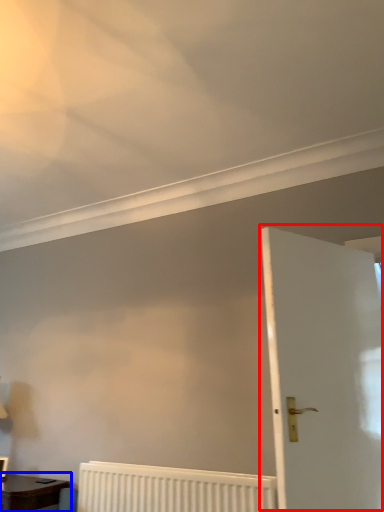
Question: Which object is closer to the camera taking this photo, door (highlighted by a red box) or table (highlighted by a blue box)?

Choices:
 (A) door
 (B) table

Answer: (A)